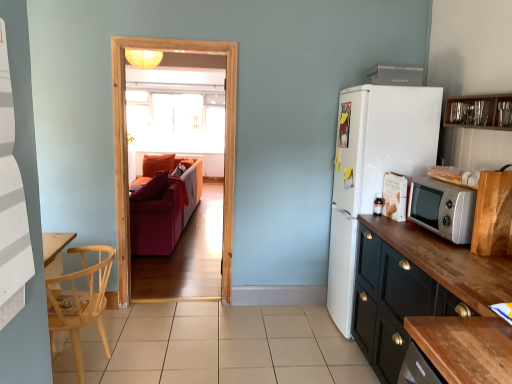
What are the coordinates of `free space above black wood cabinet at right, which is the third cabinetry from top to bottom (from a real-world perspective)` in the screenshot? It's located at (450, 253).